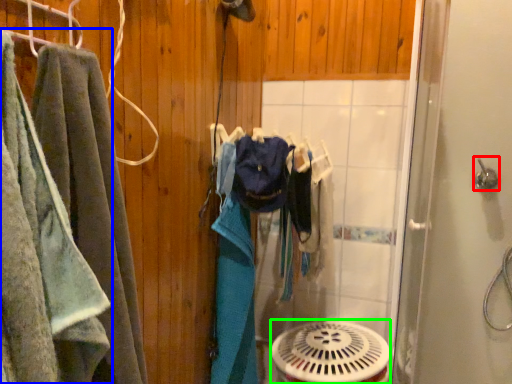
Question: Considering the real-world distances, which object is farthest from shower (highlighted by a red box)? towel (highlighted by a blue box) or mechanical fan (highlighted by a green box)?

Choices:
 (A) towel
 (B) mechanical fan

Answer: (A)